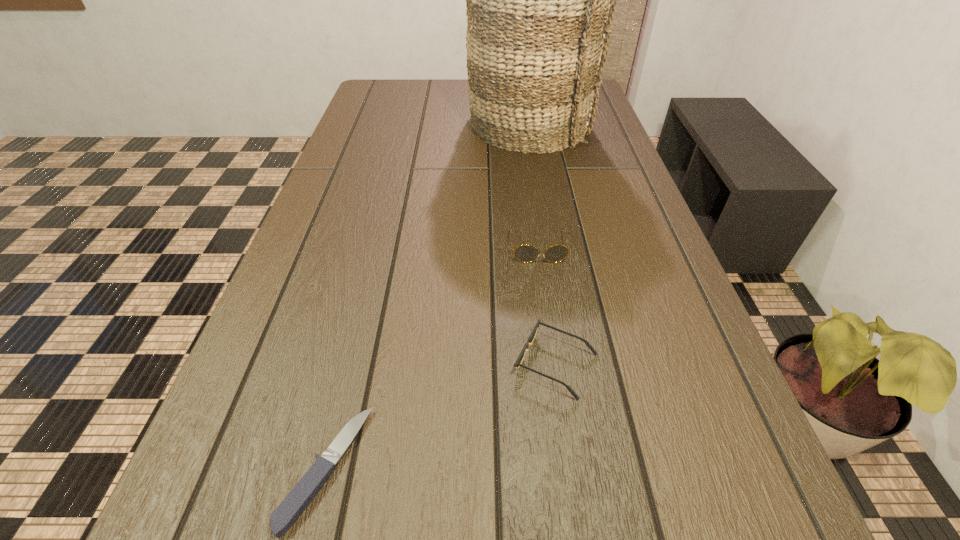
You are a GUI agent. You are given a task and a screenshot of the screen. Output one action in this format:
    pyautogui.click(x=<x>, y=<y>)
    Task: Click on the farthest object
    
    Given the screenshot: What is the action you would take?
    pyautogui.click(x=540, y=0)

Image resolution: width=960 pixels, height=540 pixels. In order to click on basket in this screenshot , I will do coord(540,0).

The image size is (960, 540). I want to click on the farther sunglasses, so click(x=525, y=253).

Identify the location of the second farthest object. (525, 253).

At what (x,y) coordinates should I click in order to perform the action: click on the second shortest object. Please return your answer as a coordinate pair (x, y). The width and height of the screenshot is (960, 540). Looking at the image, I should click on (518, 362).

Locate an element on the screen. This screenshot has width=960, height=540. the shorter sunglasses is located at coordinates (518, 362).

You are a GUI agent. You are given a task and a screenshot of the screen. Output one action in this format:
    pyautogui.click(x=<x>, y=<y>)
    Task: Click on the nearest object
    
    Given the screenshot: What is the action you would take?
    pyautogui.click(x=299, y=498)

The height and width of the screenshot is (540, 960). I want to click on steak knife, so click(299, 498).

Locate an element on the screen. This screenshot has width=960, height=540. vacant area located 0.350m on the front of the basket is located at coordinates (547, 242).

Find the location of a particular element. This screenshot has height=540, width=960. vacant region located on the lenses of the third shortest object is located at coordinates (545, 296).